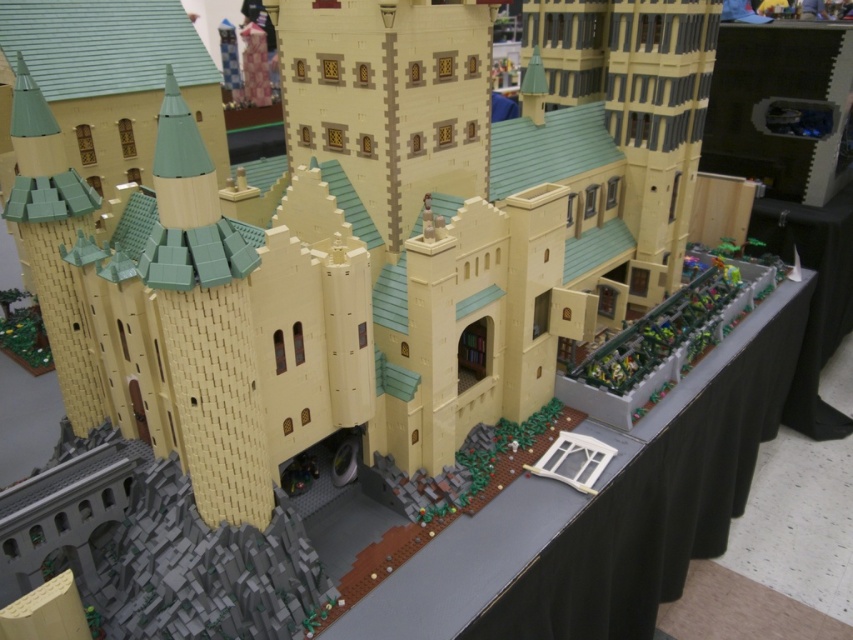
Question: Which point is closer to the camera?

Choices:
 (A) black fabric table at center
 (B) light yellow brick castle at center

Answer: (B)

Question: Can you confirm if light yellow brick castle at center is positioned above black fabric table at center?

Choices:
 (A) yes
 (B) no

Answer: (A)

Question: Is light yellow brick castle at center below black fabric table at center?

Choices:
 (A) no
 (B) yes

Answer: (A)

Question: Considering the relative positions of light yellow brick castle at center and black fabric table at center in the image provided, where is light yellow brick castle at center located with respect to black fabric table at center?

Choices:
 (A) above
 (B) below

Answer: (A)

Question: Which point is closer to the camera?

Choices:
 (A) (630, 470)
 (B) (157, 257)

Answer: (B)